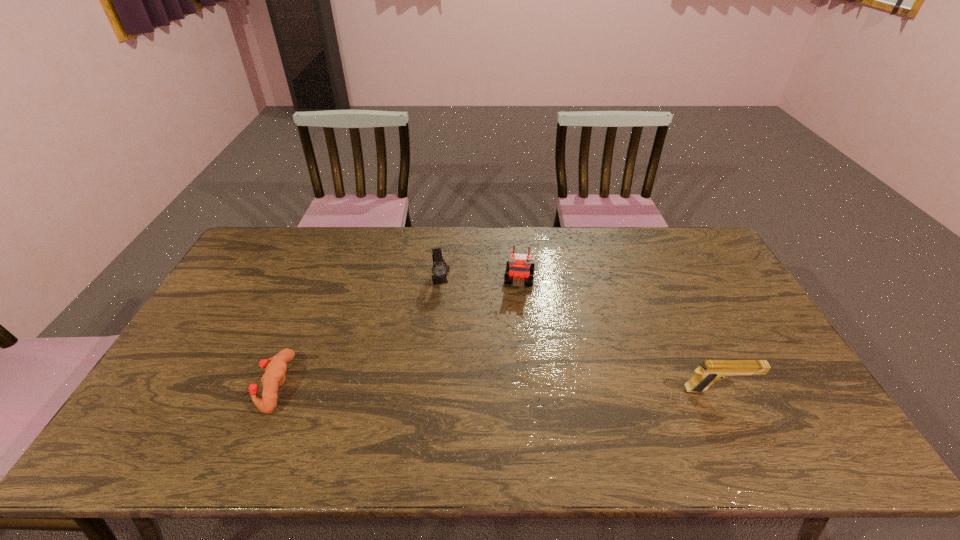
Find the location of `free space between the Lego and the rightmost object`. free space between the Lego and the rightmost object is located at coordinates (619, 335).

Find the location of a particular element. The height and width of the screenshot is (540, 960). free spot between the third object from left to right and the leftmost object is located at coordinates (397, 332).

Locate an element on the screen. free space between the second object from left to right and the Lego is located at coordinates (480, 279).

Image resolution: width=960 pixels, height=540 pixels. I want to click on empty space between the second object from left to right and the Lego, so click(480, 279).

Where is `free area in between the rightmost object and the second object from right to left`? The width and height of the screenshot is (960, 540). free area in between the rightmost object and the second object from right to left is located at coordinates (619, 335).

I want to click on object that is the second closest to the leftmost object, so click(519, 267).

Image resolution: width=960 pixels, height=540 pixels. Identify the location of object that ranks as the third closest to the pistol. (273, 378).

I want to click on vacant space that satisfies the following two spatial constraints: 1. on the back side of the second object from right to left; 2. on the right side of the watch, so click(x=442, y=279).